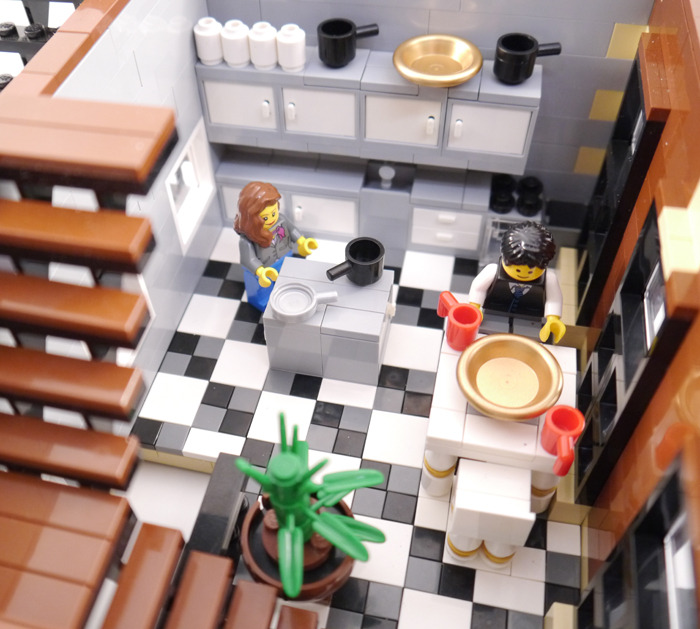
Find the location of a particular element. The image size is (700, 629). white cabinet door is located at coordinates (480, 134).